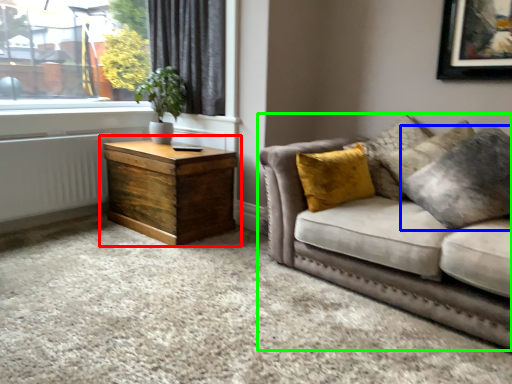
Question: Considering the real-world distances, which object is farthest from nightstand (highlighted by a red box)? pillow (highlighted by a blue box) or studio couch (highlighted by a green box)?

Choices:
 (A) pillow
 (B) studio couch

Answer: (A)